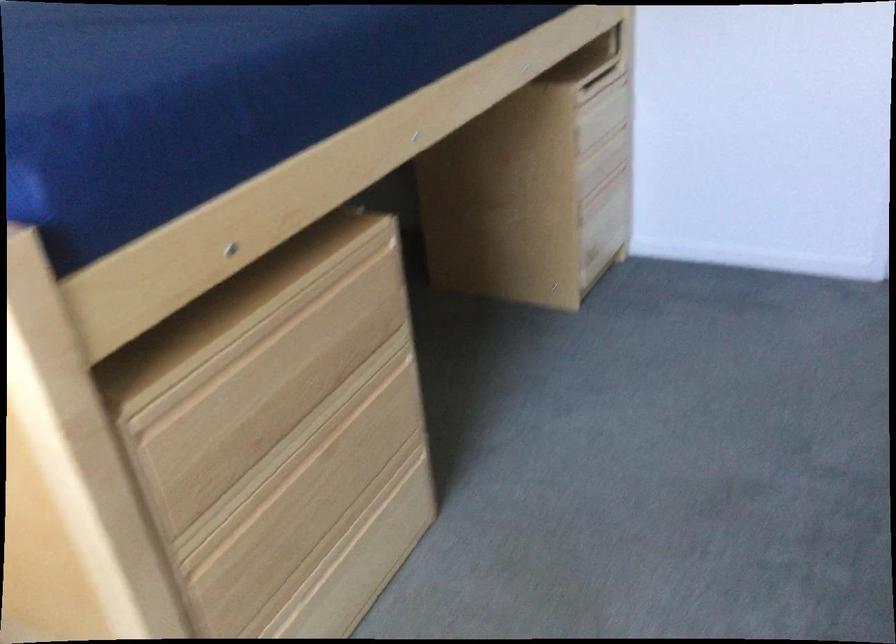
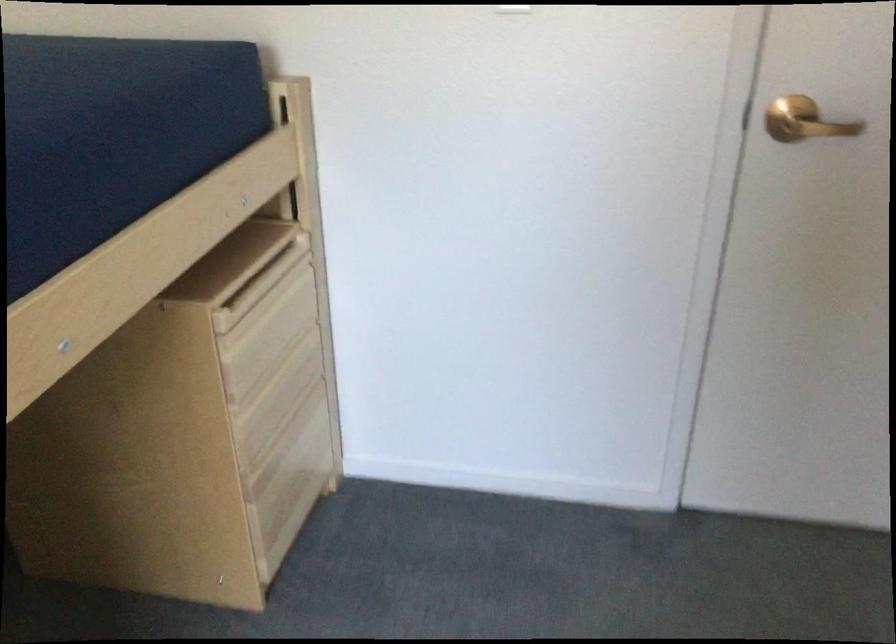
Question: In a continuous first-person perspective shot, in which direction is the camera moving?

Choices:
 (A) Left
 (B) Right
 (C) Forward
 (D) Backward

Answer: (C)